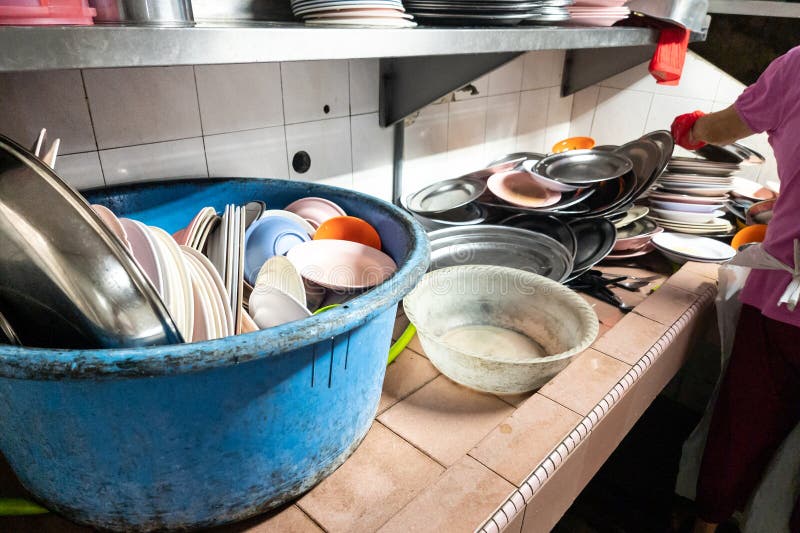
Identify the location of silver colored metal dishes. (80, 261), (469, 251), (449, 193), (590, 163), (658, 151), (649, 149), (606, 233), (554, 220), (505, 7), (525, 13).